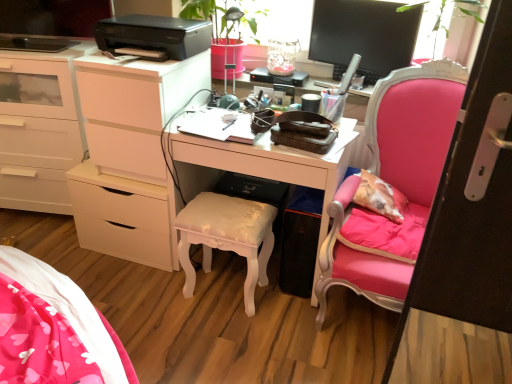
Locate an element on the screen. Image resolution: width=512 pixels, height=384 pixels. free space above white glossy stool at center (from a real-world perspective) is located at coordinates (229, 215).